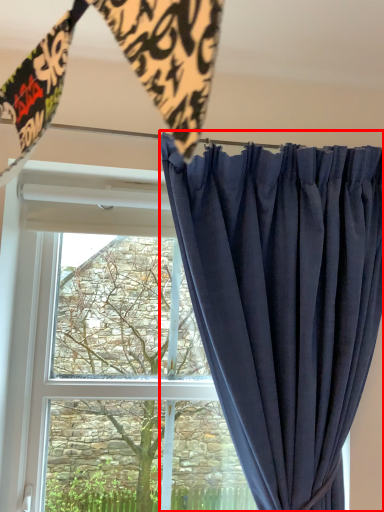
Question: From the image, what is the correct spatial relationship of curtain (annotated by the red box) in relation to tree?

Choices:
 (A) right
 (B) left

Answer: (A)